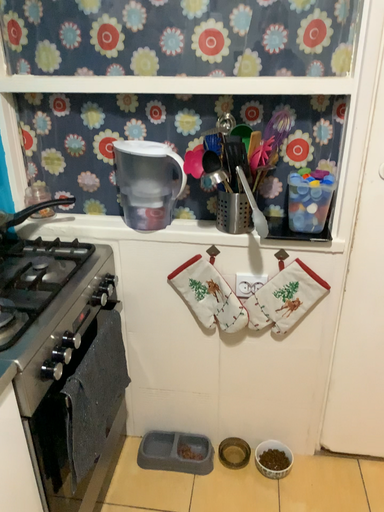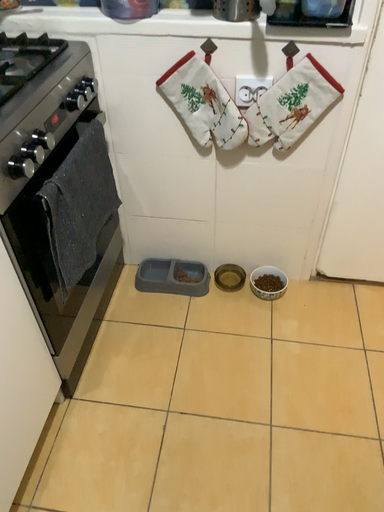
Question: Which way did the camera rotate in the video?

Choices:
 (A) rotated upward
 (B) rotated downward

Answer: (B)